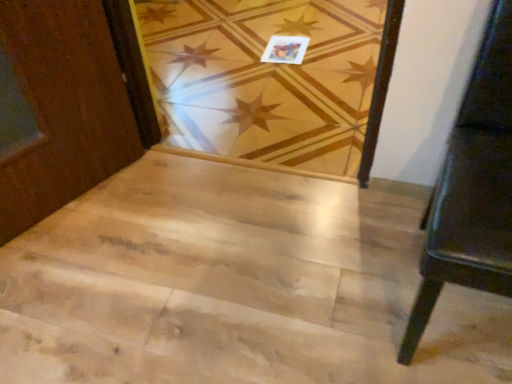
At what (x,y) coordinates should I click in order to perform the action: click on free space underneath matte paper postcard at upper center (from a real-world perspective). Please return your answer as a coordinate pair (x, y). Looking at the image, I should click on (284, 47).